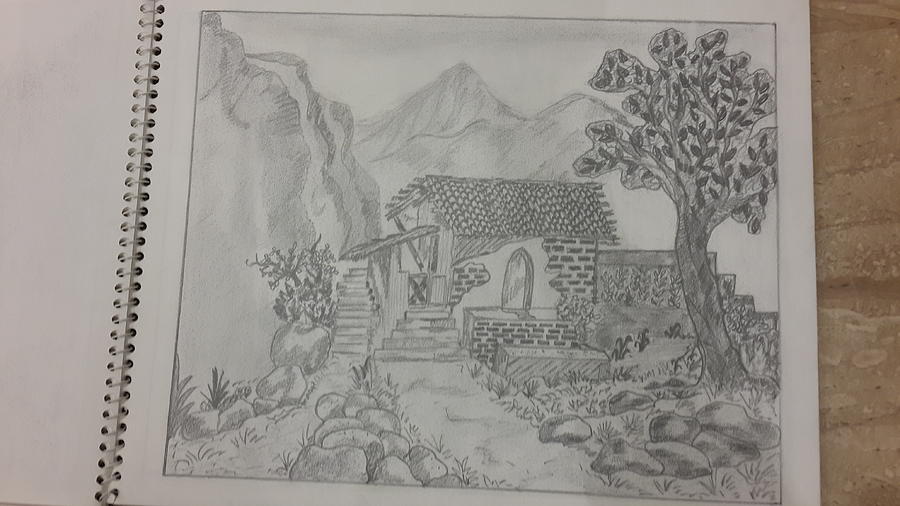
This screenshot has width=900, height=506. Find the location of `drawing of window`. drawing of window is located at coordinates (513, 281).